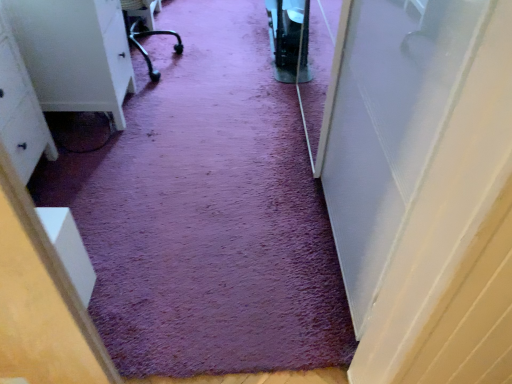
Question: Does purple carpet at center appear on the right side of white matte dresser at left?

Choices:
 (A) yes
 (B) no

Answer: (A)

Question: Is purple carpet at center positioned before white matte dresser at left?

Choices:
 (A) no
 (B) yes

Answer: (A)

Question: Considering the relative sizes of purple carpet at center and white matte dresser at left in the image provided, is purple carpet at center smaller than white matte dresser at left?

Choices:
 (A) yes
 (B) no

Answer: (B)

Question: From the image's perspective, is purple carpet at center above white matte dresser at left?

Choices:
 (A) no
 (B) yes

Answer: (B)

Question: Is purple carpet at center oriented towards white matte dresser at left?

Choices:
 (A) no
 (B) yes

Answer: (A)

Question: Is purple carpet at center with white matte dresser at left?

Choices:
 (A) no
 (B) yes

Answer: (A)

Question: Considering the relative positions of white matte dresser at left and purple carpet at center in the image provided, is white matte dresser at left behind purple carpet at center?

Choices:
 (A) no
 (B) yes

Answer: (A)

Question: Considering the relative sizes of white matte dresser at left and purple carpet at center in the image provided, is white matte dresser at left smaller than purple carpet at center?

Choices:
 (A) no
 (B) yes

Answer: (B)

Question: Is white matte dresser at left wider than purple carpet at center?

Choices:
 (A) no
 (B) yes

Answer: (A)

Question: Is white matte dresser at left thinner than purple carpet at center?

Choices:
 (A) no
 (B) yes

Answer: (B)

Question: Does white matte dresser at left lie in front of purple carpet at center?

Choices:
 (A) yes
 (B) no

Answer: (A)

Question: From a real-world perspective, is white matte dresser at left beneath purple carpet at center?

Choices:
 (A) yes
 (B) no

Answer: (B)

Question: From a real-world perspective, is purple carpet at center above or below white matte dresser at left?

Choices:
 (A) below
 (B) above

Answer: (A)